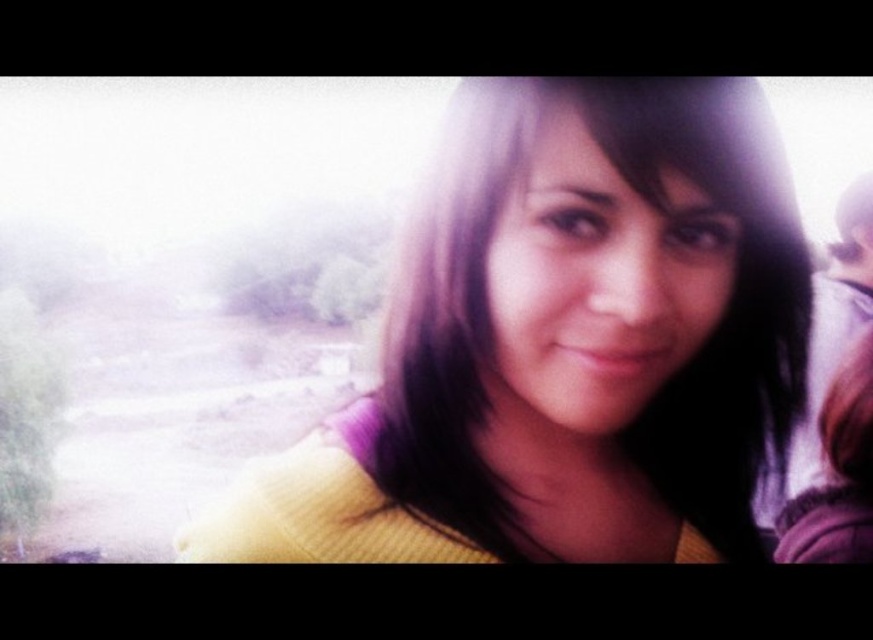
Measure the distance between point (489, 156) and camera.

Point (489, 156) is 19.49 inches from camera.

Does yellow knitted sweater at center lie in front of smooth purple sweater at right?

Yes, yellow knitted sweater at center is closer to the viewer.

Image resolution: width=873 pixels, height=640 pixels. Identify the location of yellow knitted sweater at center. (564, 342).